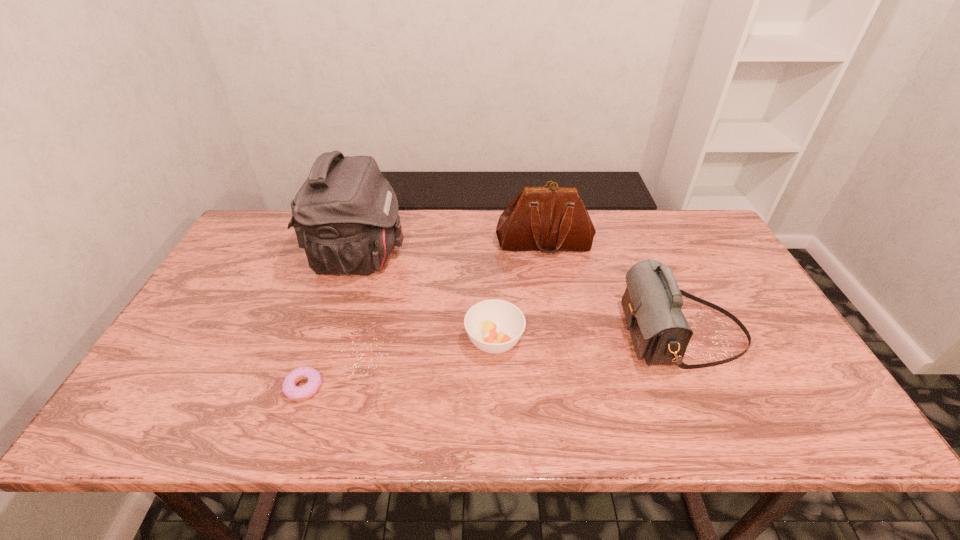
Where is `the tallest object`? This screenshot has height=540, width=960. the tallest object is located at coordinates (345, 215).

The height and width of the screenshot is (540, 960). Find the location of `the leftmost shoulder bag`. the leftmost shoulder bag is located at coordinates (345, 215).

Identify the location of the nearest shoulder bag. This screenshot has width=960, height=540. (652, 302).

Locate an element on the screen. The image size is (960, 540). the fourth tallest object is located at coordinates (494, 326).

Where is `doughnut`? The height and width of the screenshot is (540, 960). doughnut is located at coordinates (289, 388).

You are a GUI agent. You are given a task and a screenshot of the screen. Output one action in this format:
    pyautogui.click(x=<x>, y=<y>)
    Task: Click on the vacant space located 0.150m on the open flap of the leftmost shoulder bag
    The image size is (960, 540).
    Given the screenshot: What is the action you would take?
    pyautogui.click(x=454, y=257)

Locate an element on the screen. vacant space located on the back of the nearest shoulder bag is located at coordinates (645, 249).

This screenshot has width=960, height=540. I want to click on vacant space located on the front of the fourth tallest object, so click(497, 435).

Identify the location of blank area located on the back of the shortest object. This screenshot has width=960, height=540. (346, 268).

This screenshot has height=540, width=960. What are the coordinates of `object that is at the near edge` in the screenshot? It's located at (289, 388).